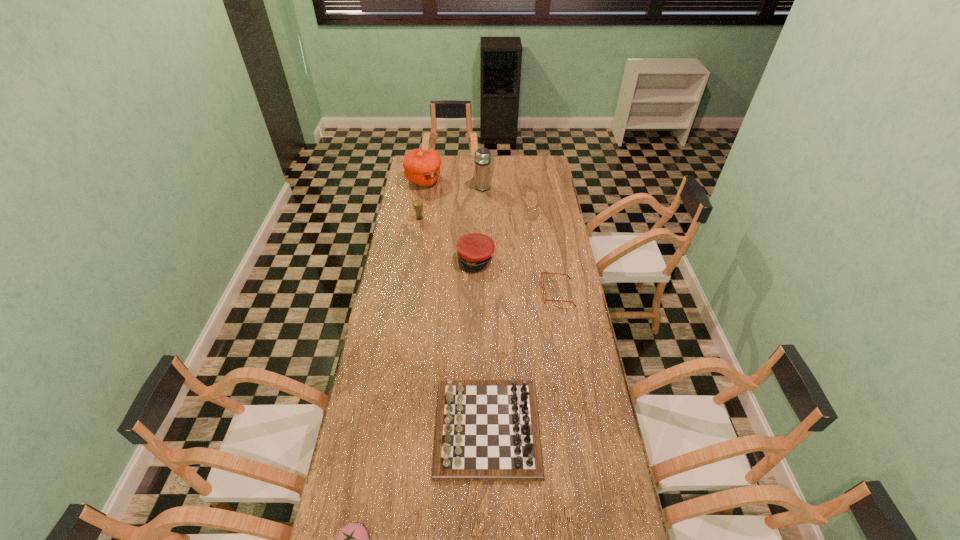
Where is `object located at the far edge`? object located at the far edge is located at coordinates (422, 167).

At what (x,y) coordinates should I click in order to perform the action: click on pumpkin located at the left edge. Please return your answer as a coordinate pair (x, y). The height and width of the screenshot is (540, 960). Looking at the image, I should click on (422, 167).

The width and height of the screenshot is (960, 540). Find the location of `straw for drinking at the left edge`. straw for drinking at the left edge is located at coordinates (417, 204).

Identify the location of object located in the right edge section of the desktop. (542, 272).

The height and width of the screenshot is (540, 960). I want to click on object located at the far left corner, so pos(422,167).

Where is `vacant space at the left edge`? This screenshot has width=960, height=540. vacant space at the left edge is located at coordinates (404, 186).

At what (x,y) coordinates should I click in order to perform the action: click on free space at the right edge of the desktop. Please return your answer as a coordinate pair (x, y). This screenshot has height=540, width=960. Looking at the image, I should click on (611, 534).

In order to click on vacant space at the far right corner of the desktop in this screenshot , I will do `click(533, 166)`.

The width and height of the screenshot is (960, 540). Identify the location of free space that is in between the thermos bottle and the shortest object. (520, 240).

You are a GUI agent. You are given a task and a screenshot of the screen. Output one action in this format:
    pyautogui.click(x=<x>, y=<y>)
    Task: Click on the free spot between the pumpkin and the second nearest object
    Image resolution: width=960 pixels, height=540 pixels.
    Given the screenshot: What is the action you would take?
    pyautogui.click(x=456, y=304)